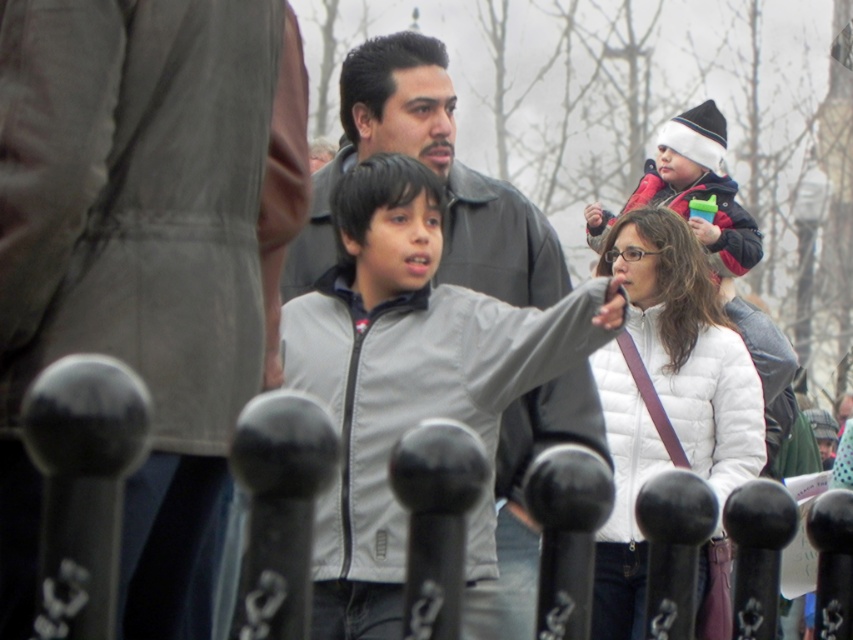
Does gray fabric jacket at center appear on the left side of light gray jacket at center?

Correct, you'll find gray fabric jacket at center to the left of light gray jacket at center.

Between point (234, 417) and point (320, 588), which one is positioned in front?

Point (234, 417) is in front.

You are a GUI agent. You are given a task and a screenshot of the screen. Output one action in this format:
    pyautogui.click(x=<x>, y=<y>)
    Task: Click on the gray fabric jacket at center
    This screenshot has width=853, height=640.
    Given the screenshot: What is the action you would take?
    pyautogui.click(x=144, y=257)

Is gray fabric jacket at center thinner than red fleece jacket at upper right?

Correct, gray fabric jacket at center's width is less than red fleece jacket at upper right's.

Looking at this image, is the position of gray fabric jacket at center less distant than that of red fleece jacket at upper right?

That is True.

Does point (114, 195) come farther from viewer compared to point (724, 237)?

No, (114, 195) is in front of (724, 237).

Where is `gray fabric jacket at center`? This screenshot has height=640, width=853. gray fabric jacket at center is located at coordinates [144, 257].

Which is in front, point (106, 368) or point (715, 170)?

Point (106, 368) is in front.

Is point (277, 394) farther from viewer compared to point (683, 209)?

That is False.

At what (x,y) coordinates should I click in order to perform the action: click on black metal fence at center. Please return your answer as a coordinate pair (x, y). The width and height of the screenshot is (853, 640). Looking at the image, I should click on (83, 486).